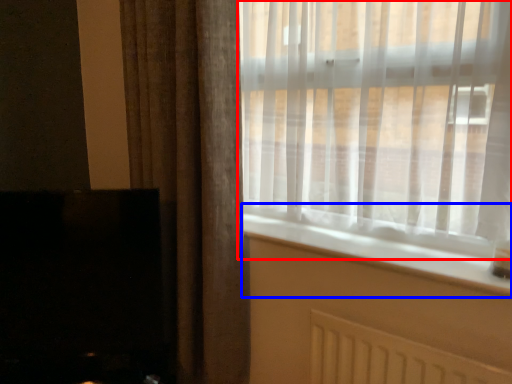
Question: Which object is closer to the camera taking this photo, window (highlighted by a red box) or window sill (highlighted by a blue box)?

Choices:
 (A) window
 (B) window sill

Answer: (A)